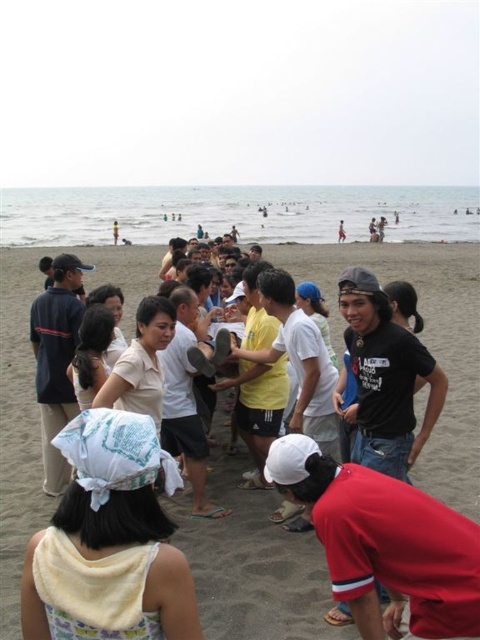
Question: Is matte yellow towel at center smaller than yellow towel at lower left?

Choices:
 (A) yes
 (B) no

Answer: (B)

Question: Which of the following is the farthest from the observer?

Choices:
 (A) yellow towel at lower left
 (B) matte yellow towel at center
 (C) red matte baseball cap at lower center

Answer: (B)

Question: Is yellow towel at lower left smaller than red matte baseball cap at lower center?

Choices:
 (A) no
 (B) yes

Answer: (B)

Question: Which point is closer to the camera?

Choices:
 (A) click(131, 445)
 (B) click(431, 532)

Answer: (A)

Question: Which object is closer to the camera taking this photo?

Choices:
 (A) matte yellow towel at center
 (B) red matte baseball cap at lower center

Answer: (B)

Question: Can you confirm if matte yellow towel at center is smaller than red matte baseball cap at lower center?

Choices:
 (A) yes
 (B) no

Answer: (B)